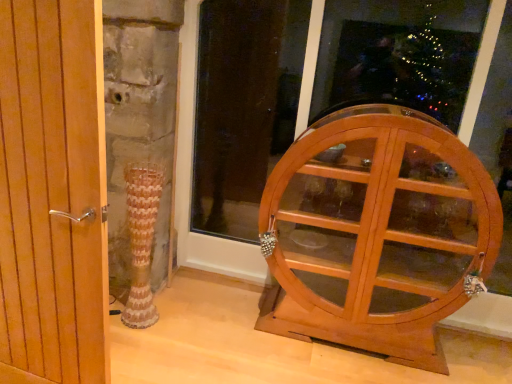
Question: From the image's perspective, relative to wooden door handle at left, is light brown wooden cabinet at right above or below?

Choices:
 (A) below
 (B) above

Answer: (A)

Question: From a real-world perspective, relative to wooden door handle at left, is light brown wooden cabinet at right vertically above or below?

Choices:
 (A) below
 (B) above

Answer: (A)

Question: Estimate the real-world distances between objects in this image. Which object is closer to the wooden door handle at left?

Choices:
 (A) wooden cabinet at right
 (B) light brown wooden cabinet at right

Answer: (B)

Question: Estimate the real-world distances between objects in this image. Which object is closer to the light brown wooden cabinet at right?

Choices:
 (A) wooden door handle at left
 (B) wooden cabinet at right

Answer: (B)